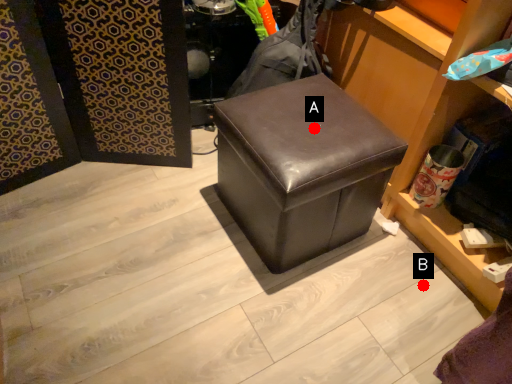
Question: Two points are circled on the image, labeled by A and B beside each circle. Which point is farther from the camera taking this photo?

Choices:
 (A) A is further
 (B) B is further

Answer: (B)